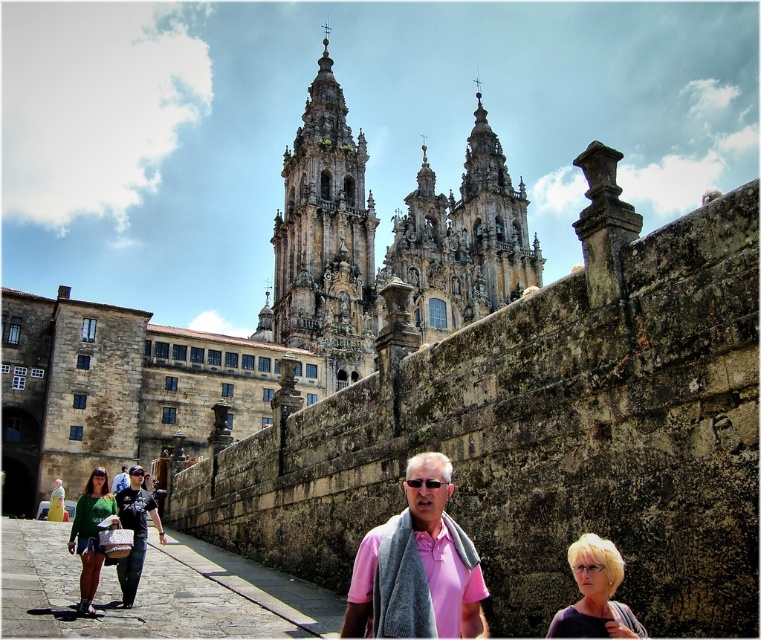
Between stone-carved tower at center and blonde hair at lower right, which one has less height?

blonde hair at lower right is shorter.

Can you confirm if stone-carved tower at center is positioned to the right of blonde hair at lower right?

No, stone-carved tower at center is not to the right of blonde hair at lower right.

This screenshot has height=640, width=761. What do you see at coordinates (323, 232) in the screenshot?
I see `stone-carved tower at center` at bounding box center [323, 232].

What are the coordinates of `stone-carved tower at center` in the screenshot? It's located at (323, 232).

Between pink cotton shirt at center and pink fabric at center, which one appears on the left side from the viewer's perspective?

pink fabric at center is more to the left.

Between point (406, 532) and point (126, 468), which one is positioned in front?

Point (406, 532) is in front.

Locate an element on the screen. pink cotton shirt at center is located at coordinates (416, 564).

Does stone-carved tower at center have a larger size compared to matte green shirt at lower left?

Yes, stone-carved tower at center is bigger than matte green shirt at lower left.

Is point (291, 163) behind point (88, 566)?

Yes.

Between point (355, 154) and point (84, 563), which one is positioned in front?

Point (84, 563) is in front.

The height and width of the screenshot is (640, 761). I want to click on stone-carved tower at center, so click(323, 232).